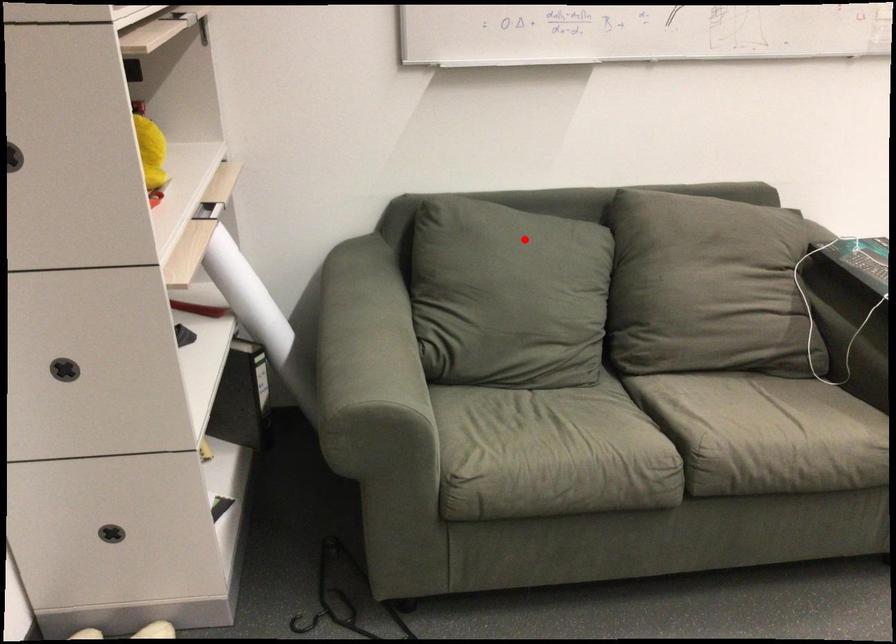
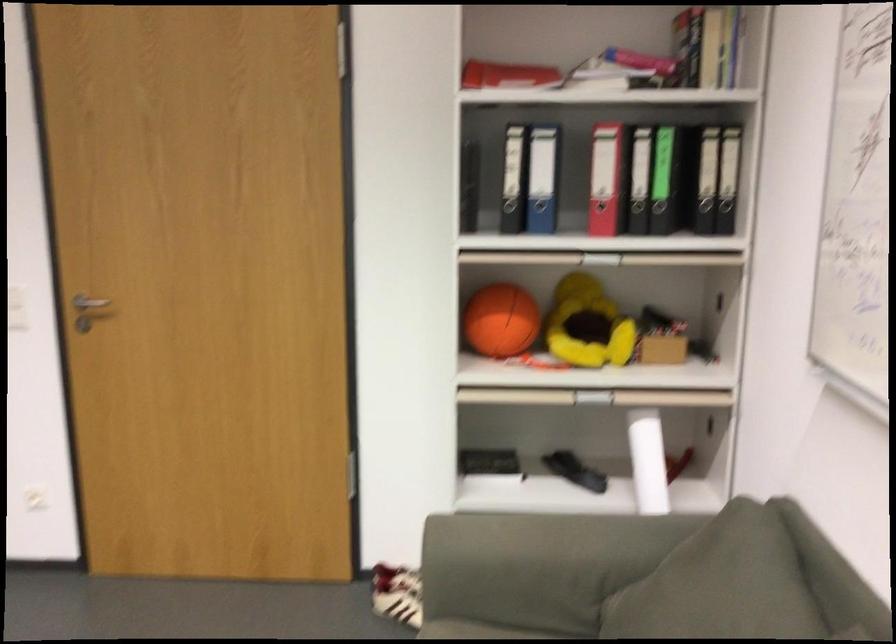
Question: I am providing you with two images of the same scene from different viewpoints. Given a red point in image1, look at the same physical point in image2. Is it:

Choices:
 (A) Closer to the viewpoint
 (B) Farther from the viewpoint

Answer: (A)